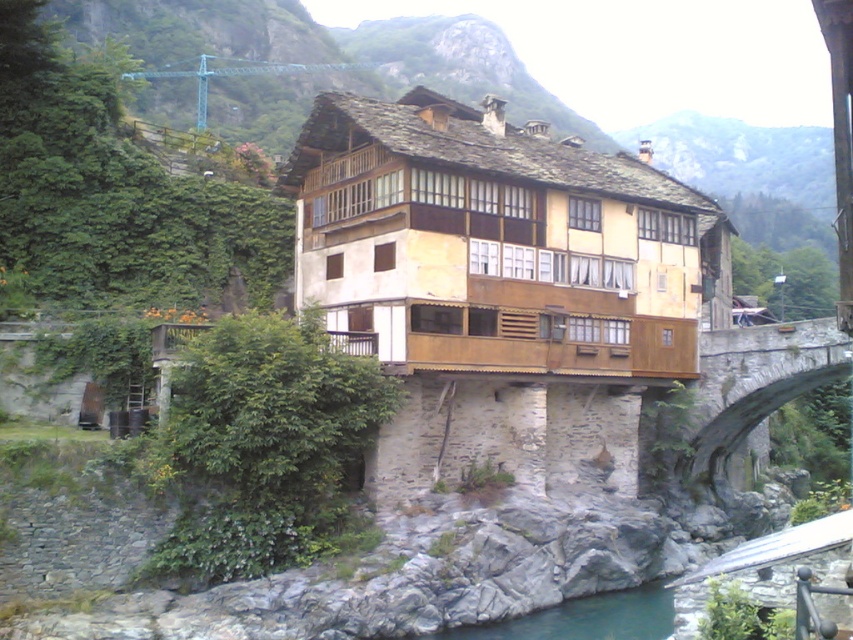
In the scene shown: You are standing at the point labeled as point (x=756, y=381). Which structure are you currently on?

You are currently on the stone arch bridge at right because the point (x=756, y=381) is located on it.

You are a tourist standing near the stone arch bridge at right and the green stone river at lower center. You want to take a photo that includes both objects in the frame. Considering their sizes, which object should you position closer to the center of the photo to ensure both are visible?

The stone arch bridge at right is bigger than the green stone river at lower center. To ensure both are visible in the photo, position the smaller green stone river at lower center closer to the center of the photo and the larger stone arch bridge at right slightly off to the side.

You are standing at the entrance of the traditional building and want to cross the river to reach the other side. Which direction should you head to find the stone arch bridge at right?

The stone arch bridge at right is located at point (756,381), so you should head towards the right side of the scene to find it.